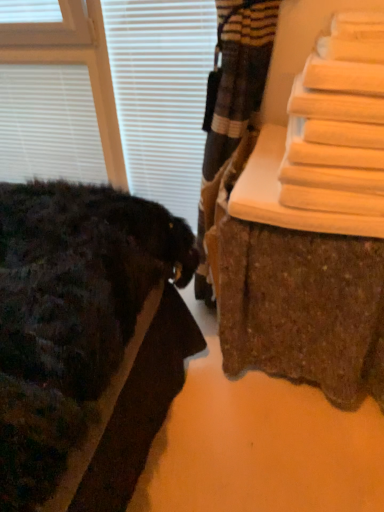
Question: In terms of size, does white matte blinds at upper left, placed as the 2th blind when sorted from right to left, appear bigger or smaller than white matte blind at upper left, marked as the 2th blind in a left-to-right arrangement?

Choices:
 (A) small
 (B) big

Answer: (A)

Question: Considering the positions of point (79, 113) and point (135, 54), is point (79, 113) closer or farther from the camera than point (135, 54)?

Choices:
 (A) closer
 (B) farther

Answer: (B)

Question: Which of these objects is positioned closest to the wooden bench at right?

Choices:
 (A) white matte blind at upper left, positioned as the 1th blind in right-to-left order
 (B) white matte blinds at upper left, which is the first blind from left to right

Answer: (A)

Question: Which object is positioned closest to the white matte blind at upper left, marked as the 2th blind in a left-to-right arrangement?

Choices:
 (A) white matte blinds at upper left, placed as the 2th blind when sorted from right to left
 (B) wooden bench at right

Answer: (A)